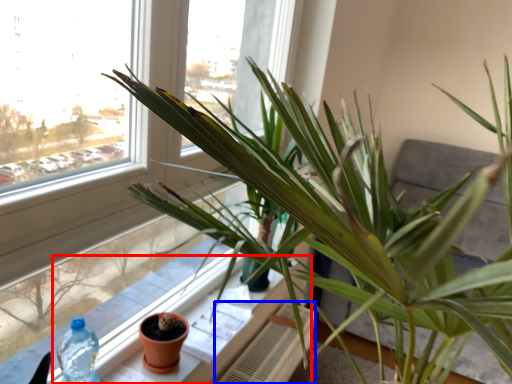
Question: Among these objects, which one is nearest to the camera, window sill (highlighted by a red box) or radiator (highlighted by a blue box)?

Choices:
 (A) window sill
 (B) radiator

Answer: (A)